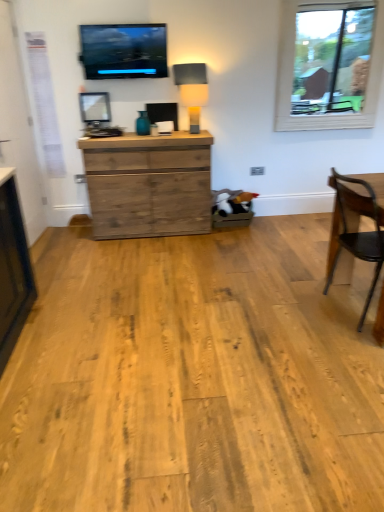
Where is `free point below matte beige lampshade at center (from a real-world perspective)`? This screenshot has height=512, width=384. free point below matte beige lampshade at center (from a real-world perspective) is located at coordinates (192, 131).